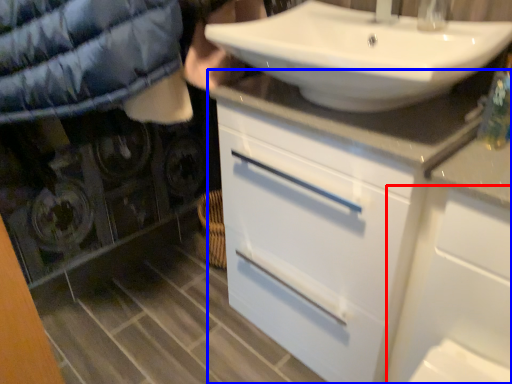
Question: Which of the following is the farthest to the observer, cabinetry (highlighted by a red box) or bathroom cabinet (highlighted by a blue box)?

Choices:
 (A) cabinetry
 (B) bathroom cabinet

Answer: (B)